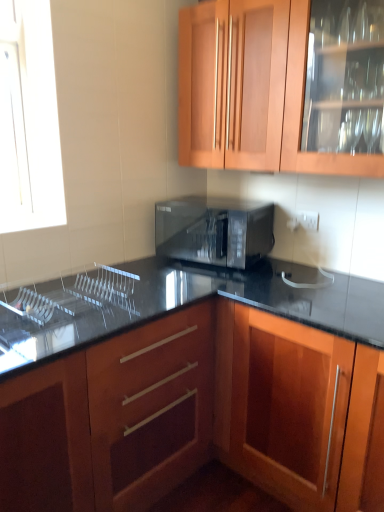
Question: Is clear glass sink at lower left a part of wooden cabinet at center, which is counted as the second cabinetry, starting from the top?

Choices:
 (A) no
 (B) yes

Answer: (A)

Question: From a real-world perspective, is wooden cabinet at center, which ranks as the 1th cabinetry in bottom-to-top order, located higher than clear glass sink at lower left?

Choices:
 (A) no
 (B) yes

Answer: (A)

Question: Considering the relative sizes of wooden cabinet at center, which is counted as the second cabinetry, starting from the top, and clear glass sink at lower left in the image provided, is wooden cabinet at center, which is counted as the second cabinetry, starting from the top, smaller than clear glass sink at lower left?

Choices:
 (A) yes
 (B) no

Answer: (B)

Question: From the image's perspective, is wooden cabinet at center, which ranks as the 1th cabinetry in bottom-to-top order, under clear glass sink at lower left?

Choices:
 (A) no
 (B) yes

Answer: (B)

Question: Are wooden cabinet at center, which is counted as the second cabinetry, starting from the top, and clear glass sink at lower left located far from each other?

Choices:
 (A) no
 (B) yes

Answer: (A)

Question: Is black glossy microwave at center taller or shorter than wooden cabinet at center, which is counted as the second cabinetry, starting from the top?

Choices:
 (A) short
 (B) tall

Answer: (A)

Question: In the image, is black glossy microwave at center positioned in front of or behind wooden cabinet at center, which is counted as the second cabinetry, starting from the top?

Choices:
 (A) front
 (B) behind

Answer: (B)

Question: From the image's perspective, is black glossy microwave at center located above or below wooden cabinet at center, which is counted as the second cabinetry, starting from the top?

Choices:
 (A) above
 (B) below

Answer: (A)

Question: Is point (246, 266) closer or farther from the camera than point (264, 309)?

Choices:
 (A) closer
 (B) farther

Answer: (B)

Question: From a real-world perspective, relative to clear glass sink at lower left, is black glossy microwave at center vertically above or below?

Choices:
 (A) below
 (B) above

Answer: (B)

Question: Relative to clear glass sink at lower left, is black glossy microwave at center in front or behind?

Choices:
 (A) behind
 (B) front

Answer: (A)

Question: Is black glossy microwave at center bigger or smaller than clear glass sink at lower left?

Choices:
 (A) big
 (B) small

Answer: (A)

Question: Is point click(258, 224) positioned closer to the camera than point click(51, 347)?

Choices:
 (A) farther
 (B) closer

Answer: (A)

Question: Would you say clear glass sink at lower left is to the left or to the right of black glossy microwave at center in the picture?

Choices:
 (A) right
 (B) left

Answer: (B)

Question: Considering the positions of clear glass sink at lower left and black glossy microwave at center in the image, is clear glass sink at lower left taller or shorter than black glossy microwave at center?

Choices:
 (A) short
 (B) tall

Answer: (A)